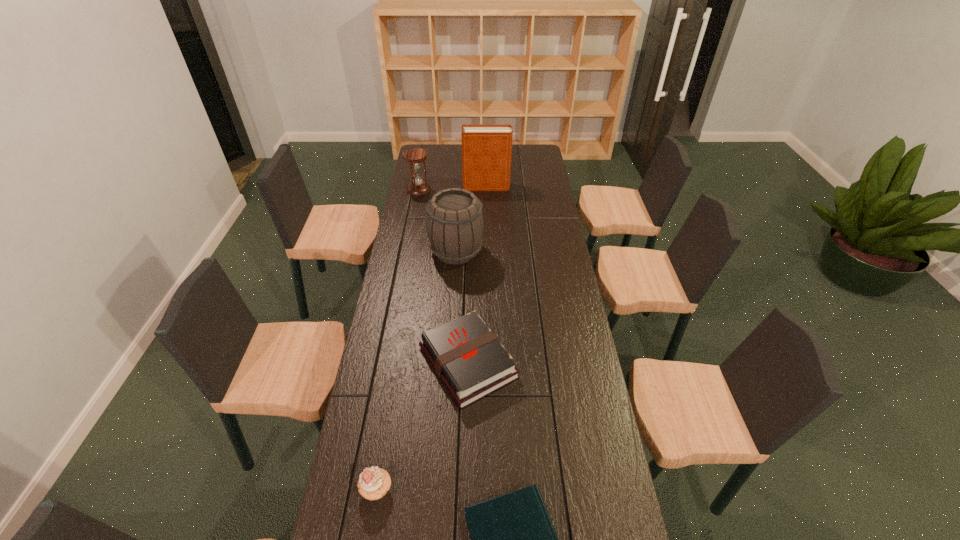
In the image, there is a desktop. Where is `vacant space at the right edge`? The width and height of the screenshot is (960, 540). vacant space at the right edge is located at coordinates (541, 225).

This screenshot has width=960, height=540. In the image, there is a desktop. Identify the location of free region at the far right corner. (525, 156).

Identify the location of vacant area that lies between the cupcake and the third tallest object. (397, 340).

You are a GUI agent. You are given a task and a screenshot of the screen. Output one action in this format:
    pyautogui.click(x=<x>, y=<y>)
    Task: Click on the free space between the second nearest book and the hourglass
    The image size is (960, 540).
    Given the screenshot: What is the action you would take?
    pyautogui.click(x=444, y=276)

Locate an element on the screen. This screenshot has width=960, height=540. blank region between the farthest book and the second shortest object is located at coordinates (477, 274).

Identify the location of free space between the second shortest object and the tallest book. The width and height of the screenshot is (960, 540). (477, 274).

This screenshot has height=540, width=960. What are the coordinates of `free space between the farthest book and the second shortest book` in the screenshot? It's located at (477, 274).

Select which object is the second closest to the tallest book. Please provide its 2D coordinates. Your answer should be formatted as a tuple, i.e. [(x, y)], where the tuple contains the x and y coordinates of a point satisfying the conditions above.

[(455, 223)]

Locate which object is the fifth closest to the second nearest book. Please provide its 2D coordinates. Your answer should be formatted as a tuple, i.e. [(x, y)], where the tuple contains the x and y coordinates of a point satisfying the conditions above.

[(486, 149)]

Identify which book is the closest to the third tallest object. Please provide its 2D coordinates. Your answer should be formatted as a tuple, i.e. [(x, y)], where the tuple contains the x and y coordinates of a point satisfying the conditions above.

[(486, 149)]